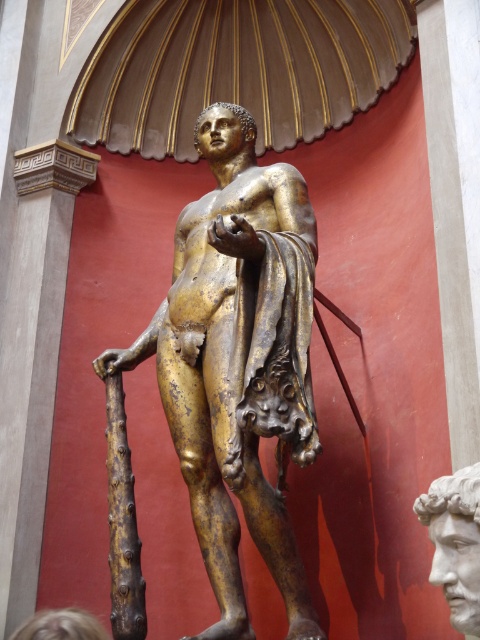
You are an art conservator examining the statue. You need to apply a protective coating to the statue. The coating machine can only spray within a radius of 0.5 units from the point where you stand. If you position yourself at the origin point, will you be able to cover the gold statue located at point (x=239, y=362)?

The gold statue is located at point (x=239, y=362). The distance from the origin to this point is sqrt0.566 squared plus 0.498 squared equals approximately 0.756 units. Since the spray radius is 0.5 units, the conservator cannot reach the statue from the origin. They need to move closer or use a different method.